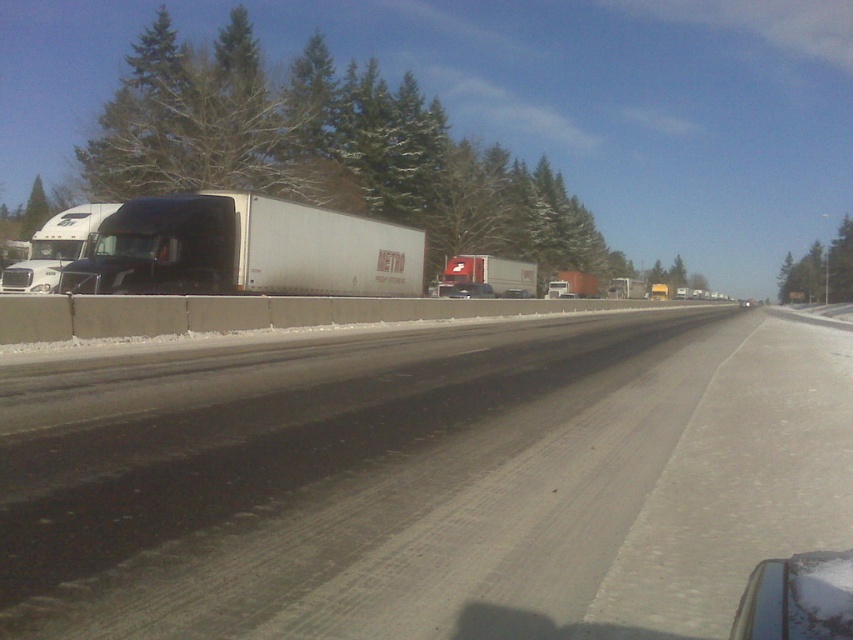
Does gray asphalt highway at center appear under white matte trailer truck at left?

Correct, gray asphalt highway at center is located below white matte trailer truck at left.

Is gray asphalt highway at center shorter than white matte trailer truck at left?

Yes.

Is point (175, 483) farther from camera compared to point (126, 244)?

No, (175, 483) is in front of (126, 244).

Where is `gray asphalt highway at center`? The image size is (853, 640). gray asphalt highway at center is located at coordinates (421, 480).

Does gray asphalt highway at center appear on the left side of white matte truck at center?

No, gray asphalt highway at center is not to the left of white matte truck at center.

Which is in front, point (764, 438) or point (480, 280)?

Point (764, 438) is more forward.

Locate an element on the screen. This screenshot has height=640, width=853. gray asphalt highway at center is located at coordinates coord(421,480).

Can you confirm if white matte trailer truck at left is positioned below white matte truck at center?

Correct, white matte trailer truck at left is located below white matte truck at center.

Can you confirm if white matte trailer truck at left is positioned above white matte truck at center?

Actually, white matte trailer truck at left is below white matte truck at center.

Is point (271, 291) positioned in front of point (473, 280)?

That is True.

You are a GUI agent. You are given a task and a screenshot of the screen. Output one action in this format:
    pyautogui.click(x=<x>, y=<y>)
    Task: Click on the white matte trailer truck at left
    The image size is (853, 640).
    Given the screenshot: What is the action you would take?
    pyautogui.click(x=245, y=250)